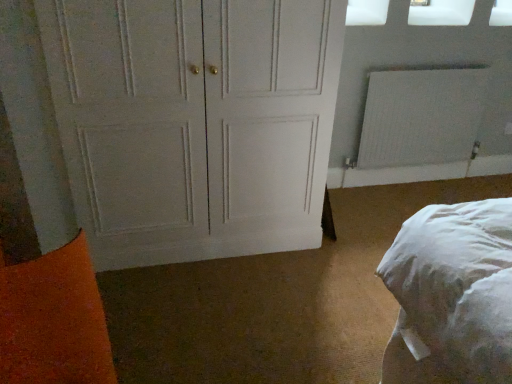
Question: Is white matte window screen at upper right, the first window screen from the left, bigger or smaller than white textured radiator at upper right?

Choices:
 (A) big
 (B) small

Answer: (B)

Question: In terms of width, does white matte window screen at upper right, the first window screen from the left, look wider or thinner when compared to white textured radiator at upper right?

Choices:
 (A) thin
 (B) wide

Answer: (B)

Question: Which is farther from the transparent plastic window screen at upper right, the 1th window screen from the right?

Choices:
 (A) white matte window screen at upper right, the first window screen from the left
 (B) white painted wood door at center
 (C) white textured radiator at upper right

Answer: (B)

Question: Which object is positioned closest to the transparent plastic window screen at upper right, positioned as the second window screen in left-to-right order?

Choices:
 (A) white matte window screen at upper right, the first window screen from the left
 (B) white painted wood door at center
 (C) white textured radiator at upper right

Answer: (A)